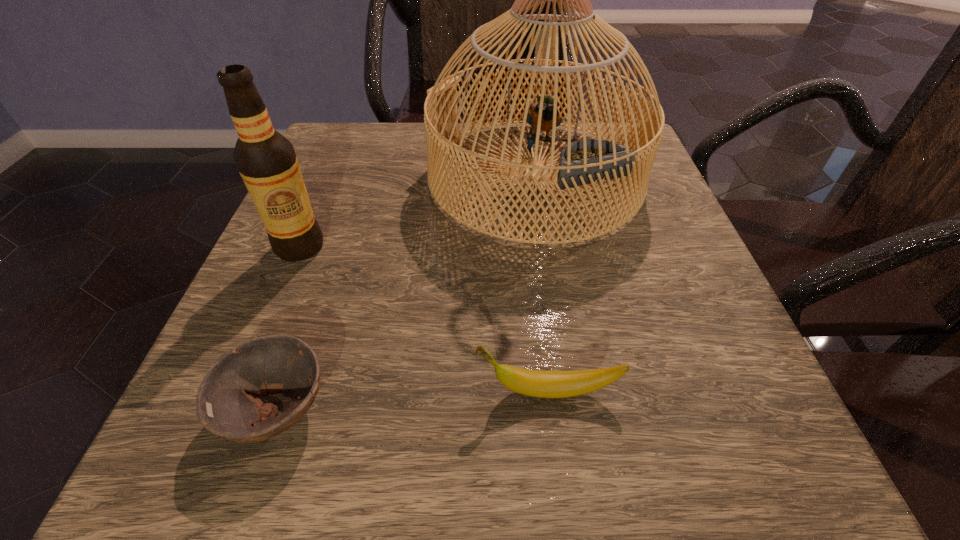
Where is `empty space that is in between the shortest object and the third shortest object`? empty space that is in between the shortest object and the third shortest object is located at coordinates (289, 328).

Find the location of a particular element. Image resolution: width=960 pixels, height=540 pixels. vacant space that's between the tallest object and the shortest object is located at coordinates (406, 293).

Select which object is the third closest to the birdcage. Please provide its 2D coordinates. Your answer should be formatted as a tuple, i.e. [(x, y)], where the tuple contains the x and y coordinates of a point satisfying the conditions above.

[(544, 384)]

Identify which object is the nearest to the tallest object. Please provide its 2D coordinates. Your answer should be formatted as a tuple, i.e. [(x, y)], where the tuple contains the x and y coordinates of a point satisfying the conditions above.

[(266, 160)]